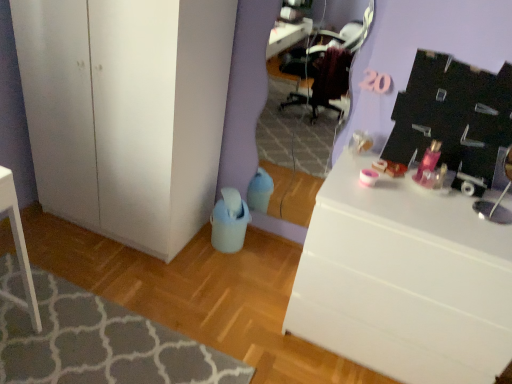
Question: Visually, is matte purple mirror at center positioned to the left or to the right of white glossy desk at right?

Choices:
 (A) right
 (B) left

Answer: (B)

Question: In terms of width, does matte purple mirror at center look wider or thinner when compared to white glossy desk at right?

Choices:
 (A) wide
 (B) thin

Answer: (B)

Question: Which is farther from the white glossy desk at right?

Choices:
 (A) matte purple mirror at center
 (B) white matte cabinet at lower left
 (C) textured gray rug at lower left

Answer: (A)

Question: Which of these objects is positioned farthest from the white glossy desk at right?

Choices:
 (A) textured gray rug at lower left
 (B) matte purple mirror at center
 (C) white matte cabinet at lower left

Answer: (B)